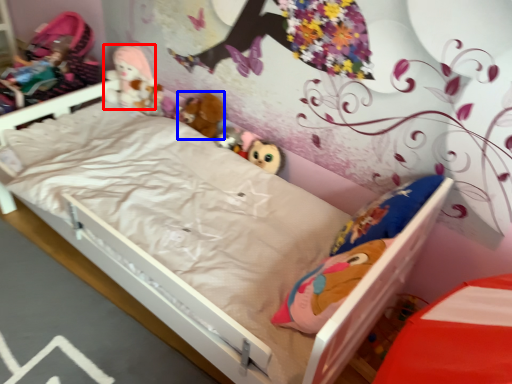
Question: Which point is closer to the camera, doll (highlighted by a red box) or doll (highlighted by a blue box)?

Choices:
 (A) doll
 (B) doll

Answer: (B)